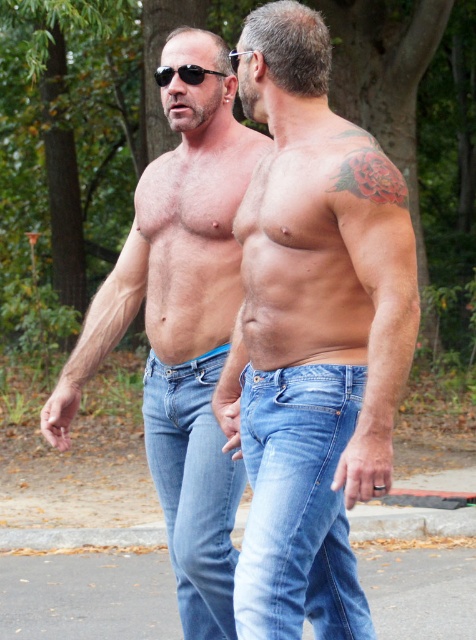
You are a tailor measuring the distance between two pairs of jeans for a fitting session. You see the matte blue jeans at center and the denim jeans at lower right. Can the two pairs of jeans be placed side by side on a 30 inch wide table without overlapping?

The distance between the matte blue jeans at center and denim jeans at lower right is 27.41 inches, so yes, they can be placed side by side on a 30 inch wide table since the required space is less than the table width.

You are a fashion designer observing two men in the image. You need to determine which pair of denim jeans is shorter between the denim jeans at lower right and the denim jeans at center. Based on the scene, which one is shorter?

The denim jeans at lower right is shorter than the denim jeans at center because the denim jeans at lower right is not as tall as denim jeans at center.